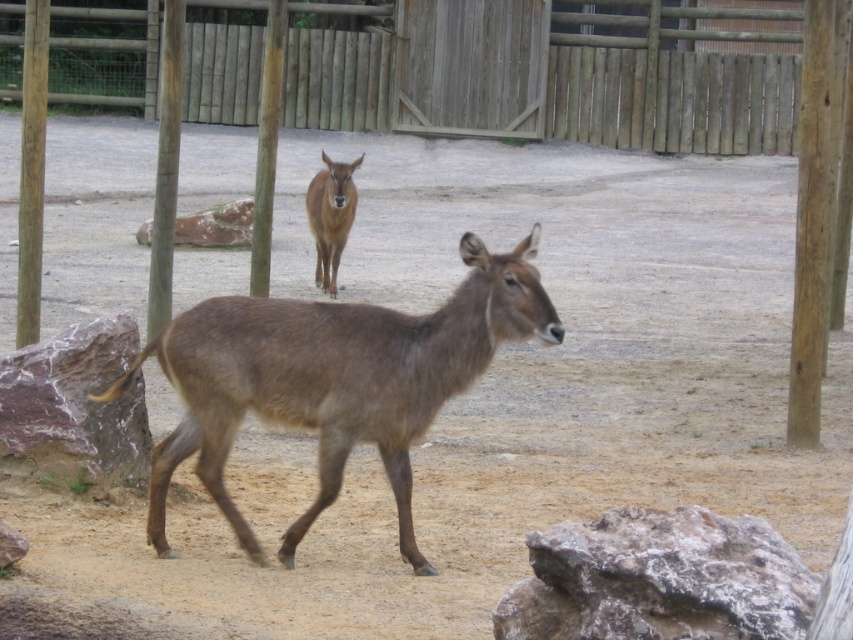
You are a zookeeper who needs to feed the brown fur deer at center. The wooden gate at upper center is the only entrance. Can you reach the deer without going through the gate?

The brown fur deer at center is located below the wooden gate at upper center, so you can reach the deer without going through the gate by approaching from the lower area near the deer.

Looking at this image, you are a zookeeper standing at the camera position. You need to place a new feeding station exactly 7 meters away from where you are standing. Can you place it at the point marked as point (x=534, y=246)?

The point marked as point (x=534, y=246) is 6.98 meters from the camera, so yes, you can place the feeding station there since it is almost exactly 7 meters away.